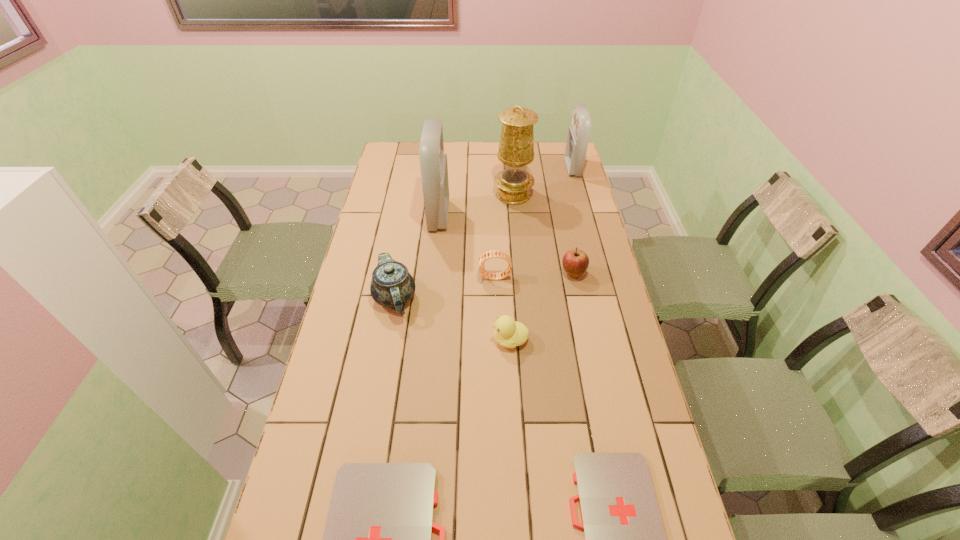
Image resolution: width=960 pixels, height=540 pixels. In order to click on free location located 0.300m on the left of the oil lamp in this screenshot , I will do (x=424, y=195).

Locate an element on the screen. This screenshot has width=960, height=540. free space located on the front-facing side of the tallest first-aid kit is located at coordinates (543, 216).

Where is `free space located 0.200m on the front-facing side of the smaller red first-aid kit`? The width and height of the screenshot is (960, 540). free space located 0.200m on the front-facing side of the smaller red first-aid kit is located at coordinates (523, 168).

Locate an element on the screen. Image resolution: width=960 pixels, height=540 pixels. vacant space situated 0.200m on the front-facing side of the smaller red first-aid kit is located at coordinates 523,168.

Locate an element on the screen. The height and width of the screenshot is (540, 960). free space located on the front-facing side of the smaller red first-aid kit is located at coordinates [493, 168].

Where is `free location located from the spout of the chinaware`? This screenshot has height=540, width=960. free location located from the spout of the chinaware is located at coordinates (375, 406).

The width and height of the screenshot is (960, 540). What are the coordinates of `vacant space located on the left of the apple` in the screenshot? It's located at (527, 274).

Find the location of a particular element. vacant space located on the face of the black watch is located at coordinates (366, 278).

Where is `vacant area located on the face of the black watch`? This screenshot has height=540, width=960. vacant area located on the face of the black watch is located at coordinates (380, 278).

The height and width of the screenshot is (540, 960). In order to click on free space located on the face of the black watch in this screenshot , I will do `click(451, 278)`.